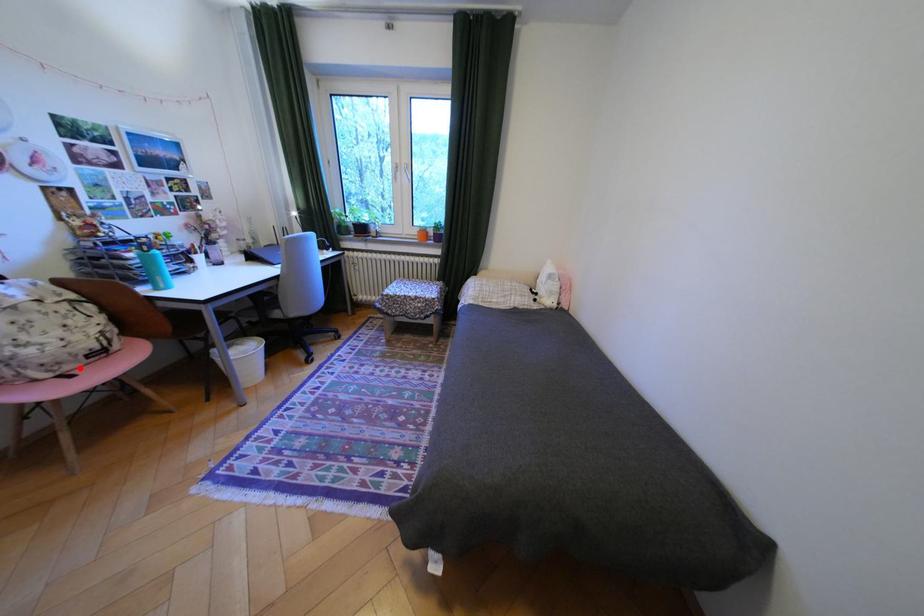
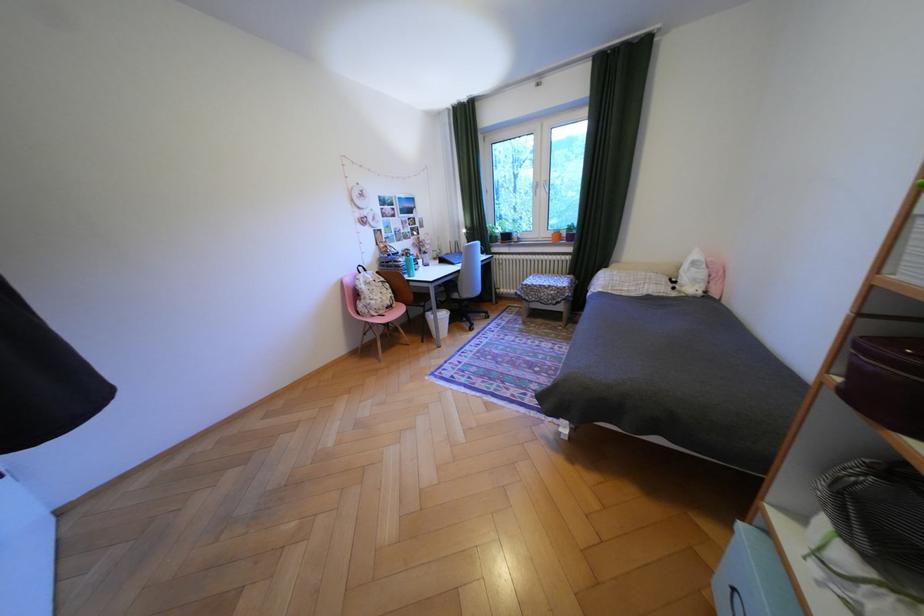
Question: I am providing you with two images of the same scene from different viewpoints. Given a red point in image1, look at the same physical point in image2. Is it:

Choices:
 (A) Closer to the viewpoint
 (B) Farther from the viewpoint

Answer: (A)